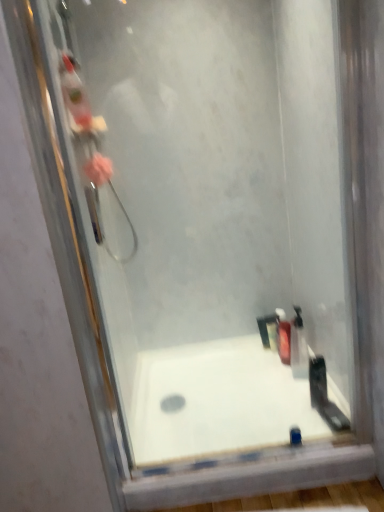
The image size is (384, 512). Identify the location of free point in front of black plastic razor at right, which is the first toiletry in front-to-back order. (315, 425).